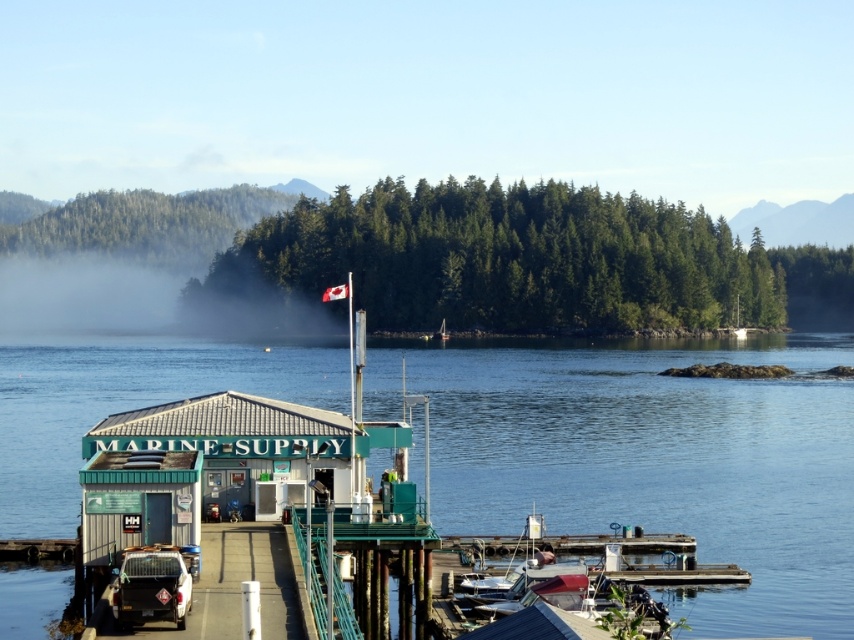
Is clear blue water at center bigger than white matte truck at lower left?

Yes, clear blue water at center is bigger than white matte truck at lower left.

Between point (446, 426) and point (126, 572), which one is positioned in front?

Point (126, 572) is more forward.

Between point (753, 620) and point (161, 556), which one is positioned behind?

The point (753, 620) is more distant.

Identify the location of clear blue water at center. Image resolution: width=854 pixels, height=640 pixels. (661, 461).

Is clear blue water at center to the left of white plastic boat at center from the viewer's perspective?

Indeed, clear blue water at center is positioned on the left side of white plastic boat at center.

How much distance is there between clear blue water at center and white plastic boat at center?

clear blue water at center and white plastic boat at center are 79.75 meters apart.

Is point (183, 348) positioned before point (744, 326)?

That is True.

The image size is (854, 640). What are the coordinates of `clear blue water at center` in the screenshot? It's located at (661, 461).

Who is more forward, (117, 600) or (735, 326)?

Point (117, 600) is in front.

Is white matte truck at lower left thinner than white plastic boat at center?

Indeed, white matte truck at lower left has a lesser width compared to white plastic boat at center.

Is point (178, 570) farther from viewer compared to point (738, 307)?

That is False.

Identify the location of white matte truck at lower left. The image size is (854, 640). (151, 588).